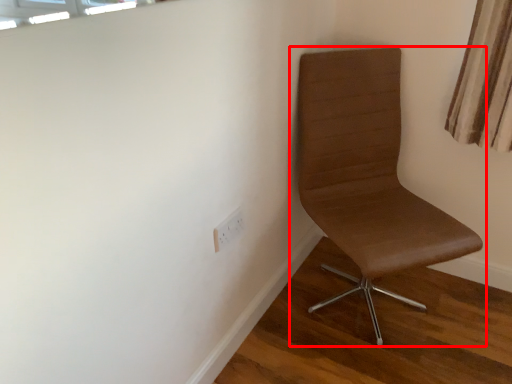
Question: Considering the relative positions of chair (annotated by the red box) and electric outlet in the image provided, where is chair (annotated by the red box) located with respect to the staircase?

Choices:
 (A) left
 (B) right

Answer: (B)